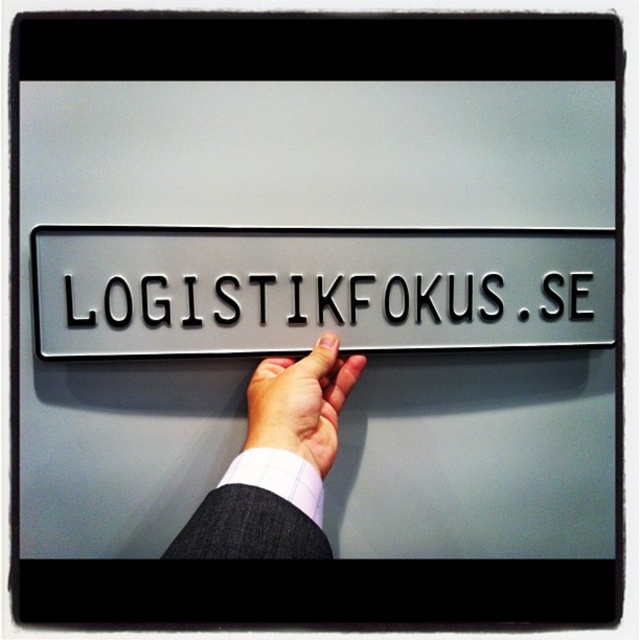
Does point (260, 508) come farther from viewer compared to point (280, 388)?

No.

In the scene shown: Is white fabric at center bigger than light skin tone flesh at center?

Indeed, white fabric at center has a larger size compared to light skin tone flesh at center.

Is point (246, 493) closer to camera compared to point (333, 432)?

Yes.

In order to click on white fabric at center in this screenshot , I will do `click(276, 464)`.

How much distance is there between satin silver sign at center and white fabric at center?

satin silver sign at center and white fabric at center are 5.86 inches apart.

Can you confirm if satin silver sign at center is taller than white fabric at center?

In fact, satin silver sign at center may be shorter than white fabric at center.

Based on the photo, measure the distance between satin silver sign at center and camera.

satin silver sign at center and camera are 30.29 inches apart from each other.

The image size is (640, 640). In order to click on satin silver sign at center in this screenshot , I will do `click(316, 291)`.

Between satin silver sign at center and light skin tone flesh at center, which one appears on the right side from the viewer's perspective?

satin silver sign at center is more to the right.

Does satin silver sign at center come in front of light skin tone flesh at center?

No, it is not.

This screenshot has width=640, height=640. I want to click on satin silver sign at center, so click(316, 291).